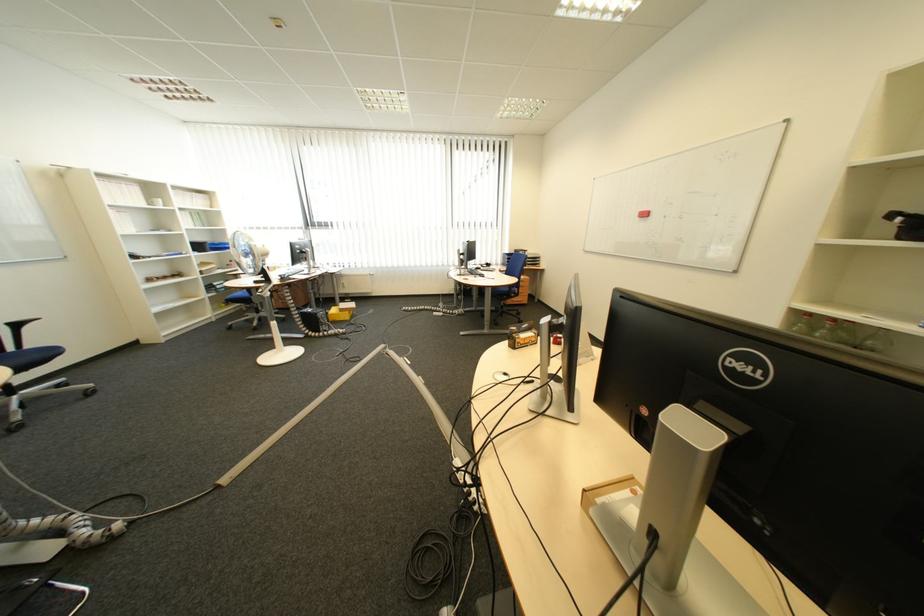
The location [341,310] corresponds to which object?

It refers to a small cardboard box.